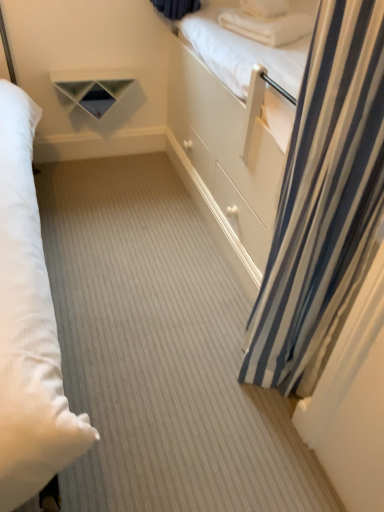
Image resolution: width=384 pixels, height=512 pixels. In order to click on vacant point to the left of blue striped curtain at right in this screenshot , I will do `click(188, 350)`.